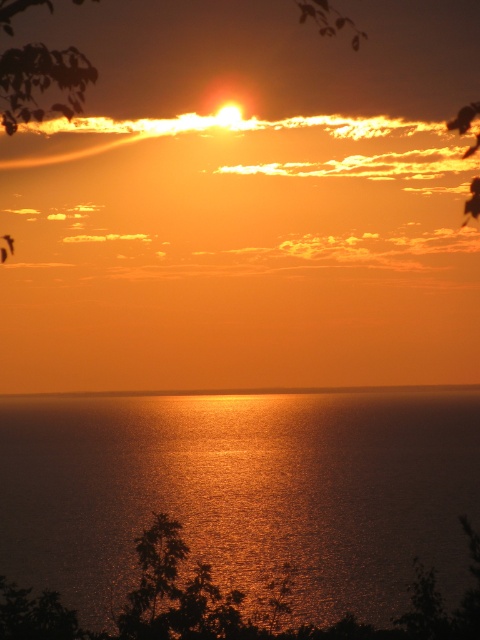
Question: In this image, where is shiny golden water at center located relative to smooth orange sky at center?

Choices:
 (A) above
 (B) below

Answer: (A)

Question: In this image, where is shiny golden water at center located relative to smooth orange sky at center?

Choices:
 (A) above
 (B) below

Answer: (A)

Question: Does shiny golden water at center have a greater width compared to smooth orange sky at center?

Choices:
 (A) yes
 (B) no

Answer: (B)

Question: Among these objects, which one is farthest from the camera?

Choices:
 (A) smooth orange sky at center
 (B) shiny golden water at center

Answer: (A)

Question: Which object is closer to the camera taking this photo?

Choices:
 (A) shiny golden water at center
 (B) smooth orange sky at center

Answer: (A)

Question: Which object is farther from the camera taking this photo?

Choices:
 (A) shiny golden water at center
 (B) smooth orange sky at center

Answer: (B)